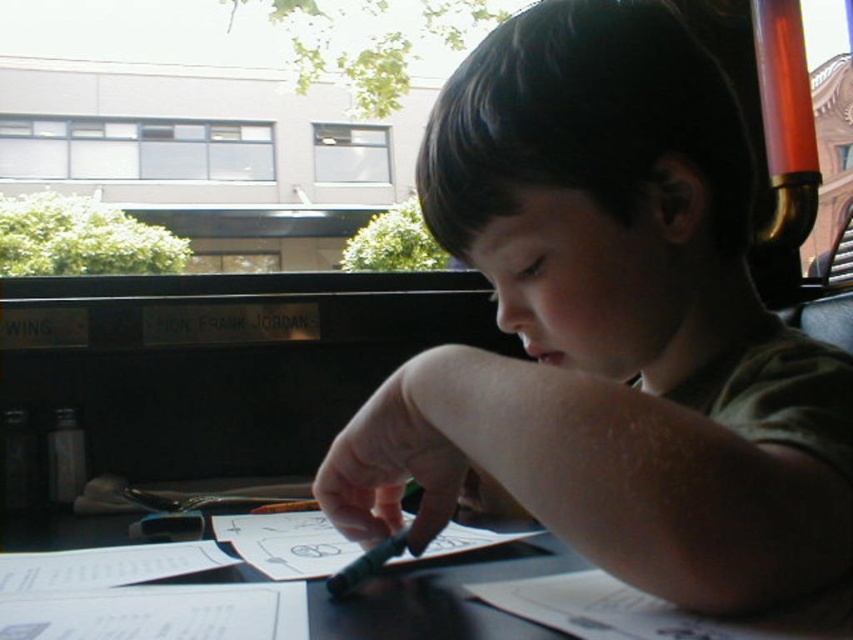
Question: Can you confirm if matte green crayon at center is positioned above black paper at center?

Choices:
 (A) yes
 (B) no

Answer: (A)

Question: From the image, what is the correct spatial relationship of matte green crayon at center in relation to black paper at center?

Choices:
 (A) left
 (B) right

Answer: (B)

Question: Is matte green crayon at center to the left of black paper at center from the viewer's perspective?

Choices:
 (A) yes
 (B) no

Answer: (B)

Question: Among these points, which one is farthest from the camera?

Choices:
 (A) (293, 632)
 (B) (486, 422)

Answer: (B)

Question: Which point is closer to the camera?

Choices:
 (A) (538, 122)
 (B) (126, 570)

Answer: (A)